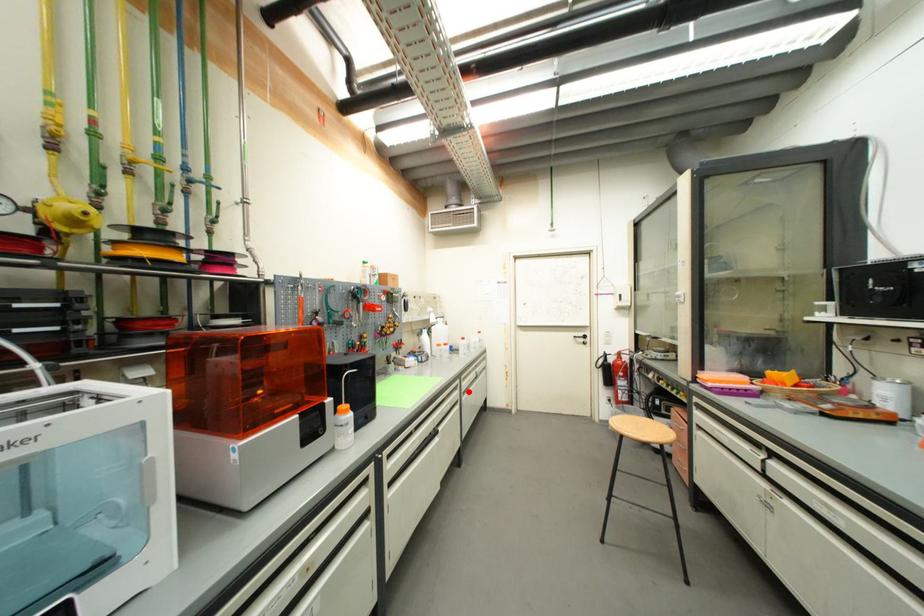
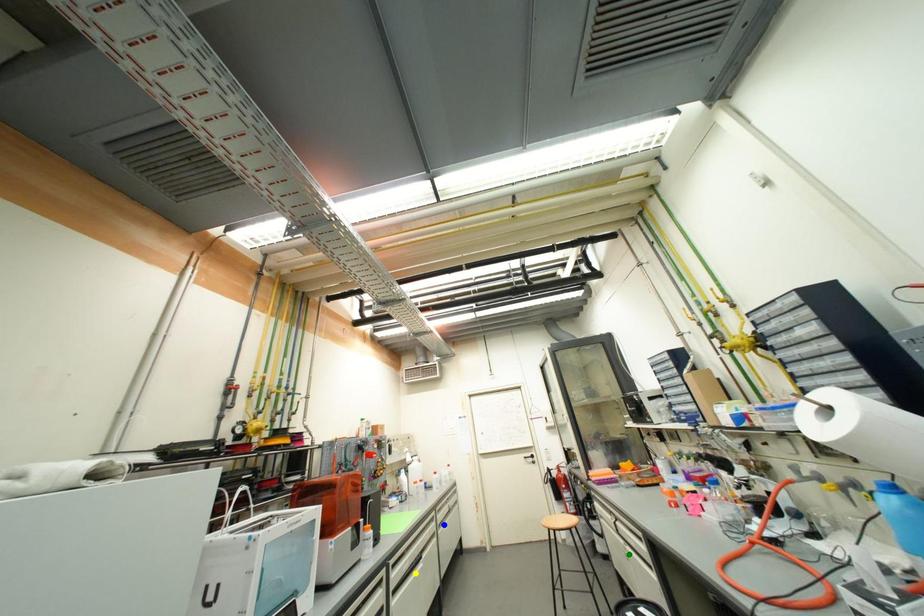
Question: I am providing you with two images of the same scene from different viewpoints. A red point is marked on the first image. You are given multiple points on the second image. In image 2, which mark is for the same physical point as the one in image 1?

Choices:
 (A) green point
 (B) blue point
 (C) yellow point

Answer: (B)